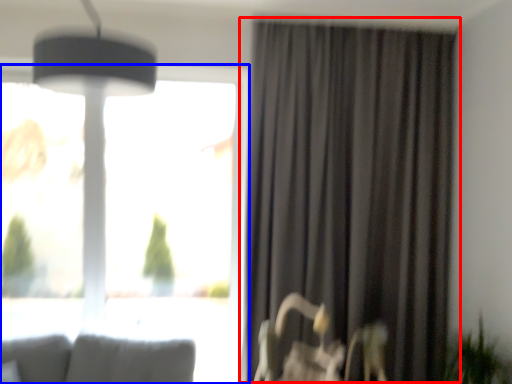
Question: Among these objects, which one is farthest to the camera, curtain (highlighted by a red box) or window (highlighted by a blue box)?

Choices:
 (A) curtain
 (B) window

Answer: (B)